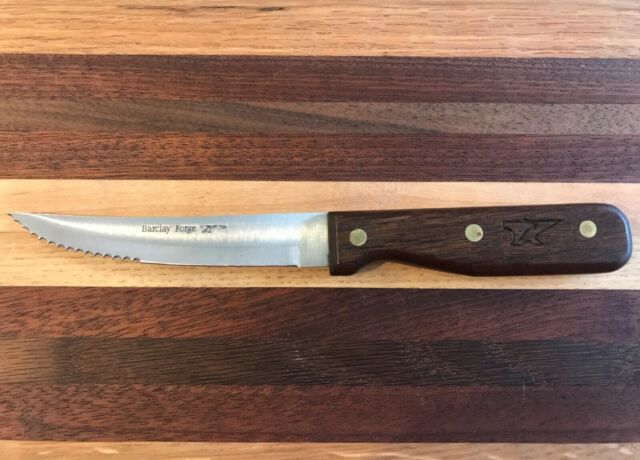
Where is `wood table`? wood table is located at coordinates (308, 342).